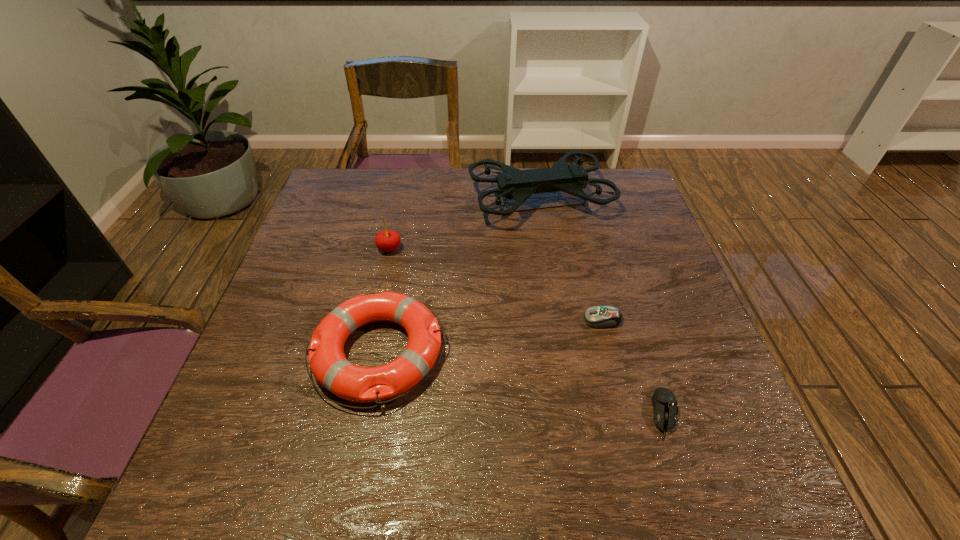
Image resolution: width=960 pixels, height=540 pixels. Find the location of `blank area in the image that satisfies the following two spatial constraints: 1. on the back side of the farthest object; 2. on the left side of the cherry`. blank area in the image that satisfies the following two spatial constraints: 1. on the back side of the farthest object; 2. on the left side of the cherry is located at coordinates (400, 199).